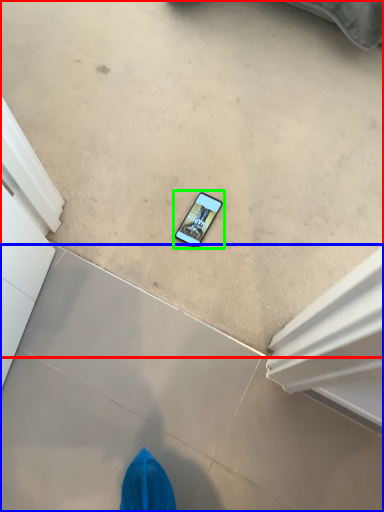
Question: Which object is positioned farthest from concrete (highlighted by a red box)? Select from concrete (highlighted by a blue box) and mobile phone (highlighted by a green box).

Choices:
 (A) concrete
 (B) mobile phone

Answer: (A)